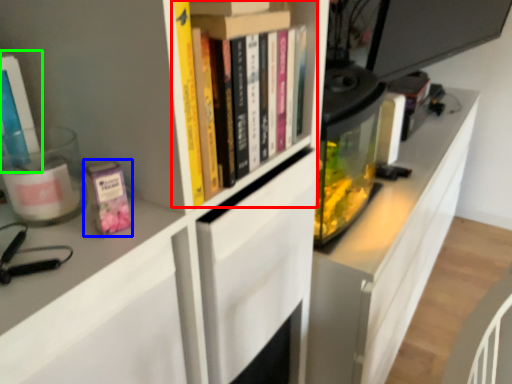
Question: Considering the real-world distances, which object is closest to book (highlighted by a red box)? paperback book (highlighted by a blue box) or book (highlighted by a green box).

Choices:
 (A) paperback book
 (B) book

Answer: (A)